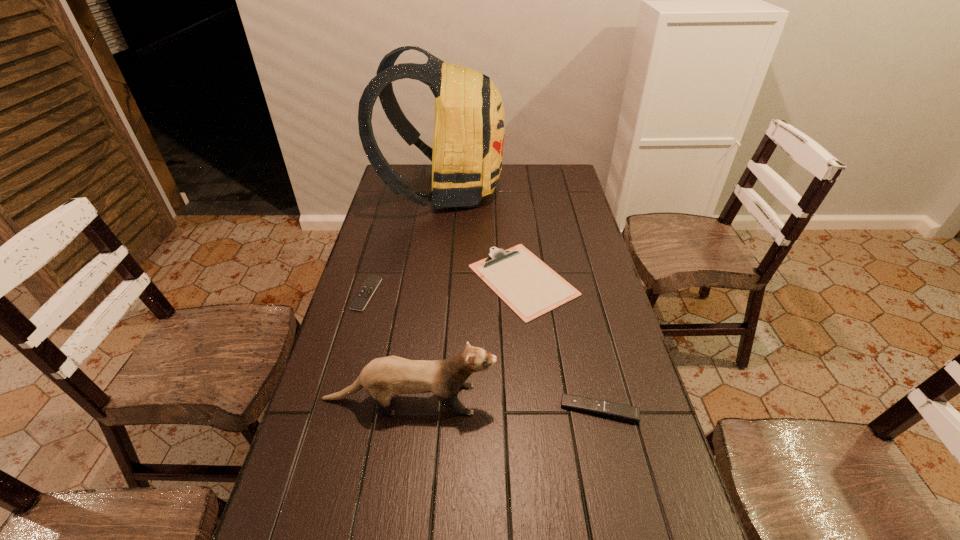
Locate an element on the screen. The image size is (960, 540). the farthest object is located at coordinates (469, 126).

Where is `the tallest object`? The height and width of the screenshot is (540, 960). the tallest object is located at coordinates (469, 126).

At what (x,y) coordinates should I click in order to perform the action: click on the second tallest object. Please return your answer as a coordinate pair (x, y). The height and width of the screenshot is (540, 960). Looking at the image, I should click on (383, 378).

Where is `clipboard`? The image size is (960, 540). clipboard is located at coordinates (526, 284).

Locate an element on the screen. This screenshot has width=960, height=540. the nearer remote control is located at coordinates (618, 411).

The height and width of the screenshot is (540, 960). Identify the location of the taller remote control. (618, 411).

At what (x,y) coordinates should I click in order to perform the action: click on the shorter remote control. Please return your answer as a coordinate pair (x, y). Looking at the image, I should click on (361, 299).

Where is `the shortest object`? This screenshot has width=960, height=540. the shortest object is located at coordinates (361, 299).

Locate an element on the screen. The image size is (960, 540). vacant space situated on the front-facing side of the backpack is located at coordinates (540, 190).

Locate an element on the screen. vacant point located 0.050m on the face of the second tallest object is located at coordinates (516, 399).